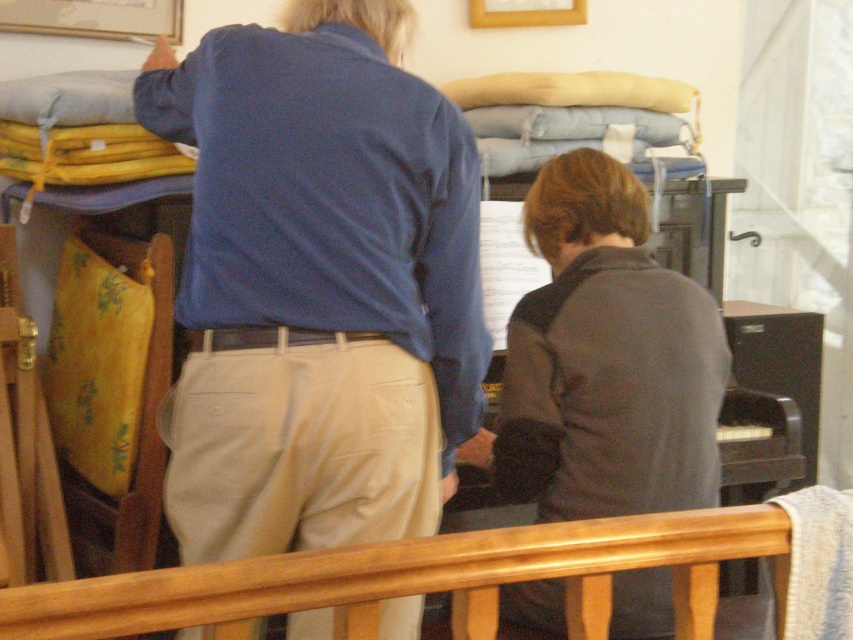
In the scene shown: Between blue cotton shirt at upper center and wooden rail at lower center, which one appears on the left side from the viewer's perspective?

blue cotton shirt at upper center

Between point (230, 42) and point (445, 582), which one is positioned in front?

Point (445, 582) is more forward.

Based on the photo, who is more forward, (186, 262) or (306, 600)?

Point (306, 600) is more forward.

You are a GUI agent. You are given a task and a screenshot of the screen. Output one action in this format:
    pyautogui.click(x=<x>, y=<y>)
    Task: Click on the blue cotton shirt at upper center
    The image size is (853, 640).
    Given the screenshot: What is the action you would take?
    pyautogui.click(x=318, y=284)

Which is above, blue cotton shirt at upper center or dark gray sweater at center?

blue cotton shirt at upper center is above.

Measure the distance from blue cotton shirt at upper center to dark gray sweater at center.

A distance of 15.62 inches exists between blue cotton shirt at upper center and dark gray sweater at center.

The width and height of the screenshot is (853, 640). Describe the element at coordinates (318, 284) in the screenshot. I see `blue cotton shirt at upper center` at that location.

The image size is (853, 640). I want to click on blue cotton shirt at upper center, so click(x=318, y=284).

Is dark gray sweater at center above wooden rail at lower center?

Indeed, dark gray sweater at center is positioned over wooden rail at lower center.

Does dark gray sweater at center lie behind wooden rail at lower center?

Yes, it is behind wooden rail at lower center.

Measure the distance between point (585, 339) and camera.

They are 1.80 meters apart.

This screenshot has height=640, width=853. I want to click on dark gray sweater at center, so click(x=606, y=358).